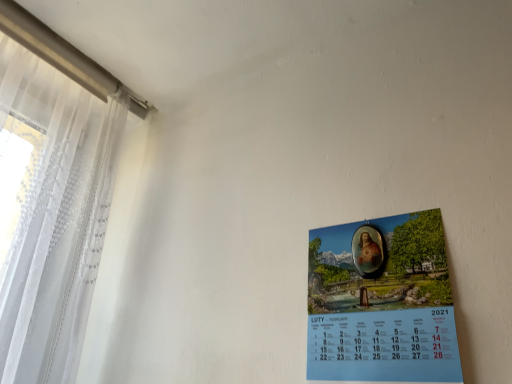
Image resolution: width=512 pixels, height=384 pixels. What do you see at coordinates (381, 302) in the screenshot?
I see `blue paper calendar at center` at bounding box center [381, 302].

This screenshot has height=384, width=512. Identify the location of blue paper calendar at center. (381, 302).

Locate an element on the screen. Image resolution: width=512 pixels, height=384 pixels. blue paper calendar at center is located at coordinates click(x=381, y=302).